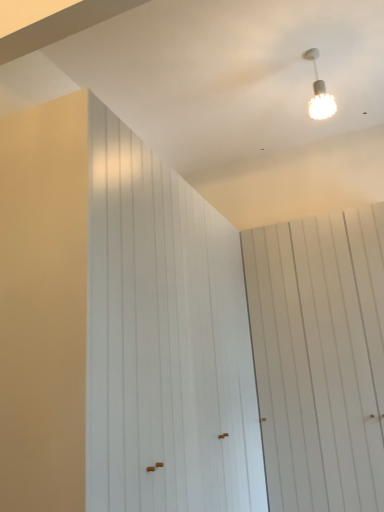
Question: Is white textured lampshade at upper right taller than white wood barn door at upper right, the 1th barn door when ordered from right to left?

Choices:
 (A) no
 (B) yes

Answer: (A)

Question: Does white textured lampshade at upper right have a larger size compared to white wood barn door at upper right, the 2th barn door positioned from the left?

Choices:
 (A) no
 (B) yes

Answer: (A)

Question: From a real-world perspective, is white textured lampshade at upper right positioned under white wood barn door at upper right, the 1th barn door when ordered from right to left, based on gravity?

Choices:
 (A) yes
 (B) no

Answer: (B)

Question: From the image's perspective, is white textured lampshade at upper right above white wood barn door at upper right, the 2th barn door positioned from the left?

Choices:
 (A) yes
 (B) no

Answer: (A)

Question: Can you confirm if white textured lampshade at upper right is smaller than white wood barn door at upper right, the 1th barn door when ordered from right to left?

Choices:
 (A) no
 (B) yes

Answer: (B)

Question: Is white textured lampshade at upper right wider or thinner than white wood barn door at upper right, the 2th barn door positioned from the left?

Choices:
 (A) wide
 (B) thin

Answer: (B)

Question: Is white textured lampshade at upper right situated inside white wood barn door at upper right, the 2th barn door positioned from the left, or outside?

Choices:
 (A) outside
 (B) inside

Answer: (A)

Question: From the image's perspective, is white textured lampshade at upper right positioned above or below white wood barn door at upper right, the 1th barn door when ordered from right to left?

Choices:
 (A) above
 (B) below

Answer: (A)

Question: Considering the positions of white textured lampshade at upper right and white wood barn door at upper right, the 2th barn door positioned from the left, in the image, is white textured lampshade at upper right taller or shorter than white wood barn door at upper right, the 2th barn door positioned from the left,?

Choices:
 (A) tall
 (B) short

Answer: (B)

Question: In the image, is white wood barn door at upper right, the 2th barn door positioned from the left, on the left side or the right side of white wood barn door at left, positioned as the 2th barn door in right-to-left order?

Choices:
 (A) left
 (B) right

Answer: (B)

Question: Considering their positions, is white wood barn door at upper right, the 2th barn door positioned from the left, located in front of or behind white wood barn door at left, positioned as the 2th barn door in right-to-left order?

Choices:
 (A) behind
 (B) front

Answer: (A)

Question: Considering the positions of point (334, 445) and point (193, 244), is point (334, 445) closer or farther from the camera than point (193, 244)?

Choices:
 (A) farther
 (B) closer

Answer: (A)

Question: From their relative heights in the image, would you say white wood barn door at upper right, the 2th barn door positioned from the left, is taller or shorter than white wood barn door at left, the first barn door viewed from the left?

Choices:
 (A) short
 (B) tall

Answer: (A)

Question: Choose the correct answer: Is white textured lampshade at upper right inside white wood barn door at left, positioned as the 2th barn door in right-to-left order, or outside it?

Choices:
 (A) inside
 (B) outside

Answer: (B)

Question: In terms of height, does white textured lampshade at upper right look taller or shorter compared to white wood barn door at left, the first barn door viewed from the left?

Choices:
 (A) short
 (B) tall

Answer: (A)